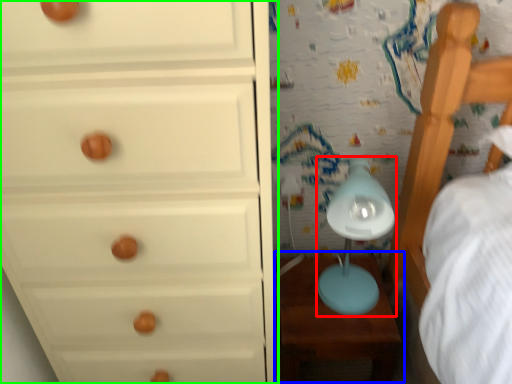
Question: Based on their relative distances, which object is farther from table lamp (highlighted by a red box)? Choose from table (highlighted by a blue box) and chest of drawers (highlighted by a green box).

Choices:
 (A) table
 (B) chest of drawers

Answer: (B)